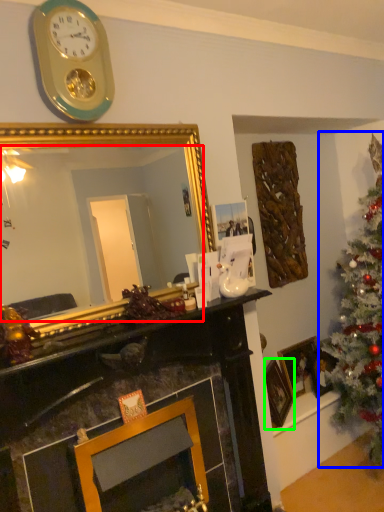
Question: Based on their relative distances, which object is farther from mirror (highlighted by a red box)? Choose from christmas tree (highlighted by a blue box) and picture frame (highlighted by a green box).

Choices:
 (A) christmas tree
 (B) picture frame

Answer: (B)